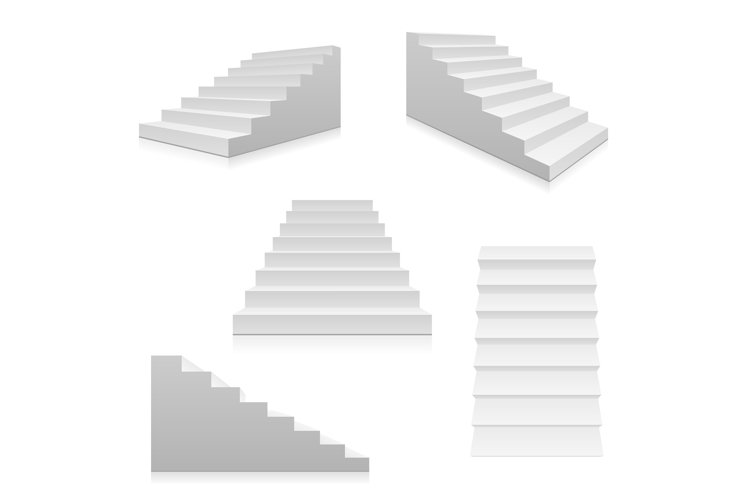
Identify the location of stairs. Image resolution: width=750 pixels, height=500 pixels. (525, 352), (298, 439), (338, 263), (292, 121), (501, 118).